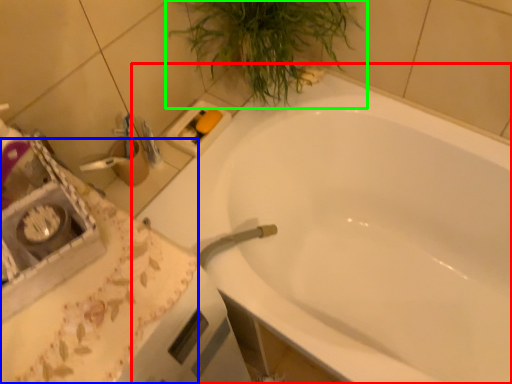
Question: Which is farther away from bathtub (highlighted by a red box)? counter top (highlighted by a blue box) or houseplant (highlighted by a green box)?

Choices:
 (A) counter top
 (B) houseplant

Answer: (A)